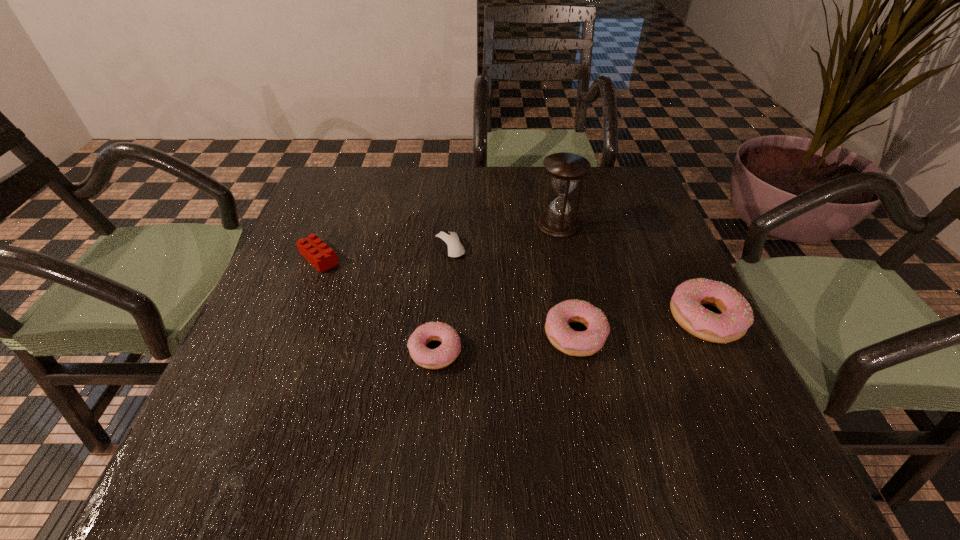
In the current image, all doughnuts are evenly spaced. To maintain this equal spacing, where should an additional doughnut be placed on the left? Please point out a free spot. Please provide its 2D coordinates. Your answer should be formatted as a tuple, i.e. [(x, y)], where the tuple contains the x and y coordinates of a point satisfying the conditions above.

[(285, 368)]